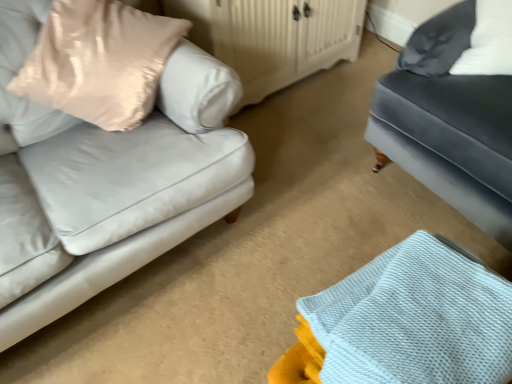
Question: In terms of height, does matte gray couch at right look taller or shorter compared to white textured fabric at lower right?

Choices:
 (A) short
 (B) tall

Answer: (B)

Question: Based on their sizes in the image, would you say matte gray couch at right is bigger or smaller than white textured fabric at lower right?

Choices:
 (A) big
 (B) small

Answer: (A)

Question: Which object is the closest to the white wood dresser at center?

Choices:
 (A) white textured fabric at lower right
 (B) satin beige pillow at left
 (C) matte gray couch at right

Answer: (B)

Question: Estimate the real-world distances between objects in this image. Which object is farther from the white wood dresser at center?

Choices:
 (A) satin beige pillow at left
 (B) matte gray couch at right
 (C) white textured fabric at lower right

Answer: (C)